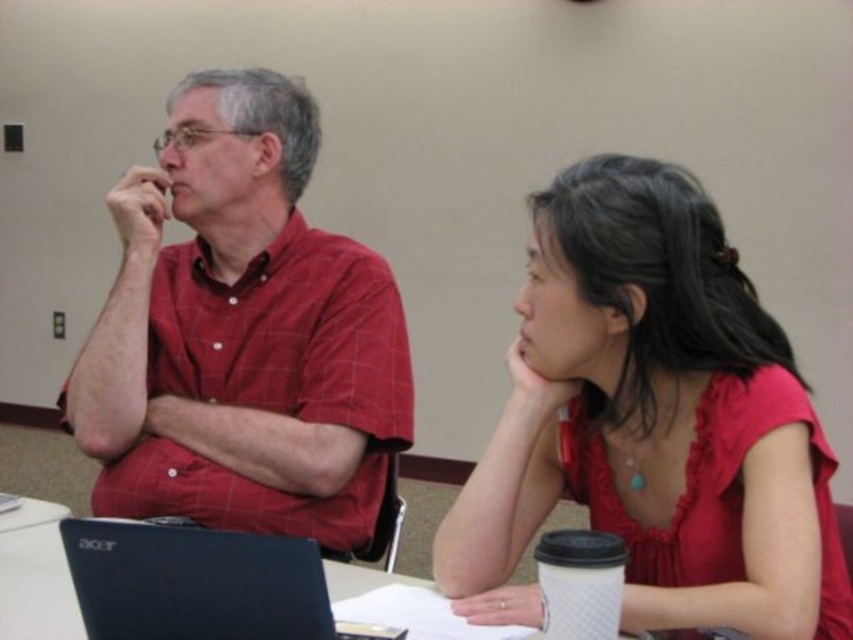
Does matte red shirt at left lie behind black matte laptop at lower left?

Yes, matte red shirt at left is behind black matte laptop at lower left.

Between point (358, 269) and point (158, 576), which one is positioned in front?

Point (158, 576)

Where is `matte red shirt at left`? matte red shirt at left is located at coordinates (241, 333).

Does point (299, 611) lie behind point (38, 625)?

No, it is not.

Between point (241, 612) and point (9, 554), which one is positioned in front?

Point (241, 612) is more forward.

Is point (244, 577) closer to viewer compared to point (47, 577)?

Yes, it is.

Find the location of `black matte laptop at lower left`. black matte laptop at lower left is located at coordinates (196, 582).

Can you confirm if matte red blouse at center is positioned to the right of white paper at center?

Indeed, matte red blouse at center is positioned on the right side of white paper at center.

Which is behind, point (630, 545) or point (16, 556)?

Positioned behind is point (16, 556).

Identify the location of matte red blouse at center. Image resolution: width=853 pixels, height=640 pixels. (653, 420).